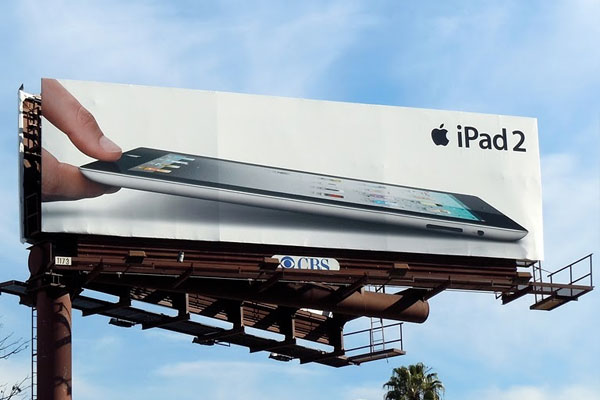
The height and width of the screenshot is (400, 600). I want to click on screen, so click(x=235, y=177).